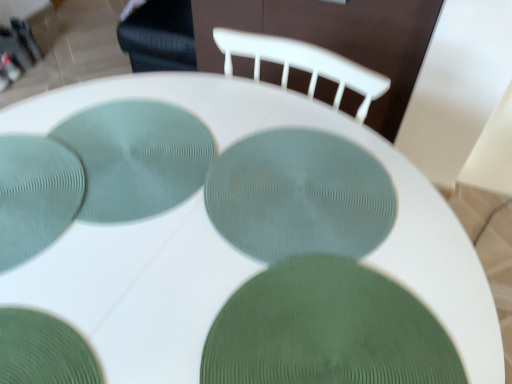
Locate an element on the screen. free space that is to the left of matte green plate at center, placed as the second glass plate when sorted from right to left is located at coordinates (132, 192).